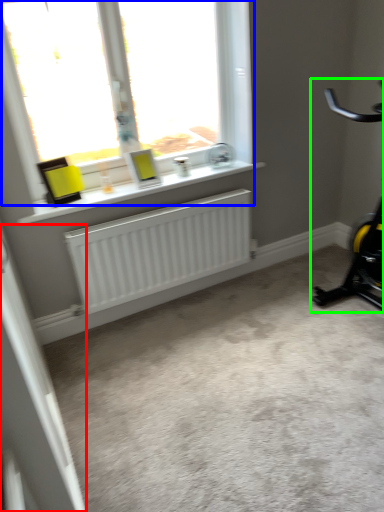
Question: Estimate the real-world distances between objects in this image. Which object is farther from screen door (highlighted by a red box), window (highlighted by a blue box) or stationary bicycle (highlighted by a green box)?

Choices:
 (A) window
 (B) stationary bicycle

Answer: (B)